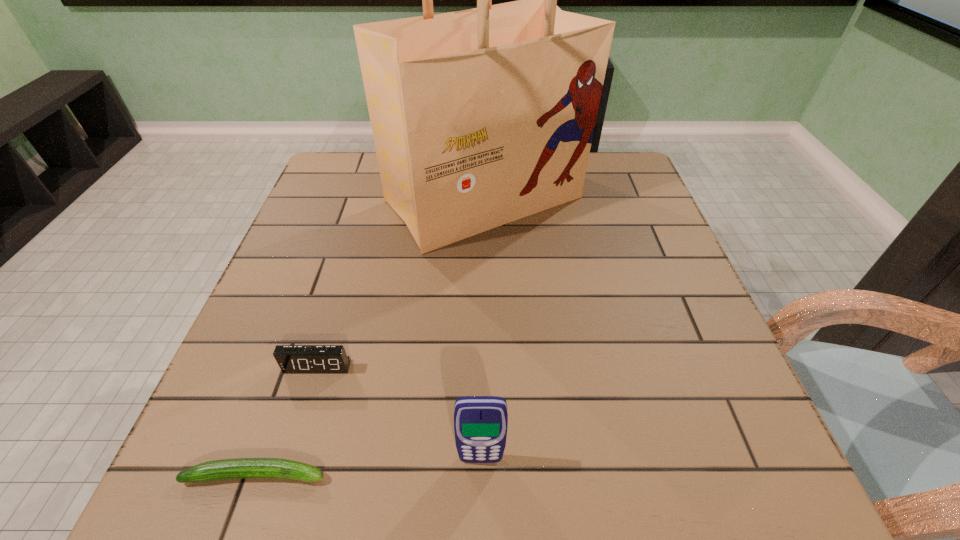
In the image, there is a desktop. In order to click on vacant space at the far right corner in this screenshot , I will do `click(622, 160)`.

The image size is (960, 540). Find the location of `blank region between the second tallest object and the shortest object`. blank region between the second tallest object and the shortest object is located at coordinates (369, 467).

This screenshot has width=960, height=540. In order to click on vacant space that's between the cellular telephone and the grocery bag in this screenshot , I will do `click(482, 329)`.

Identify the location of free space between the cellular telephone and the zucchini. This screenshot has height=540, width=960. (369, 467).

The image size is (960, 540). I want to click on free space between the third shortest object and the farthest object, so click(x=482, y=329).

This screenshot has height=540, width=960. I want to click on free space between the farthest object and the shortest object, so click(x=370, y=337).

This screenshot has width=960, height=540. What are the coordinates of `vacant area that lies between the tallest object and the cellular telephone` in the screenshot? It's located at (482, 329).

The height and width of the screenshot is (540, 960). Identify the location of vacant space that's between the tallest object and the alarm clock. (400, 283).

What are the coordinates of `free space between the shortest object and the second shortest object` in the screenshot? It's located at (287, 421).

Image resolution: width=960 pixels, height=540 pixels. Find the location of `free spot between the grocery bag and the alarm clock`. free spot between the grocery bag and the alarm clock is located at coordinates (400, 283).